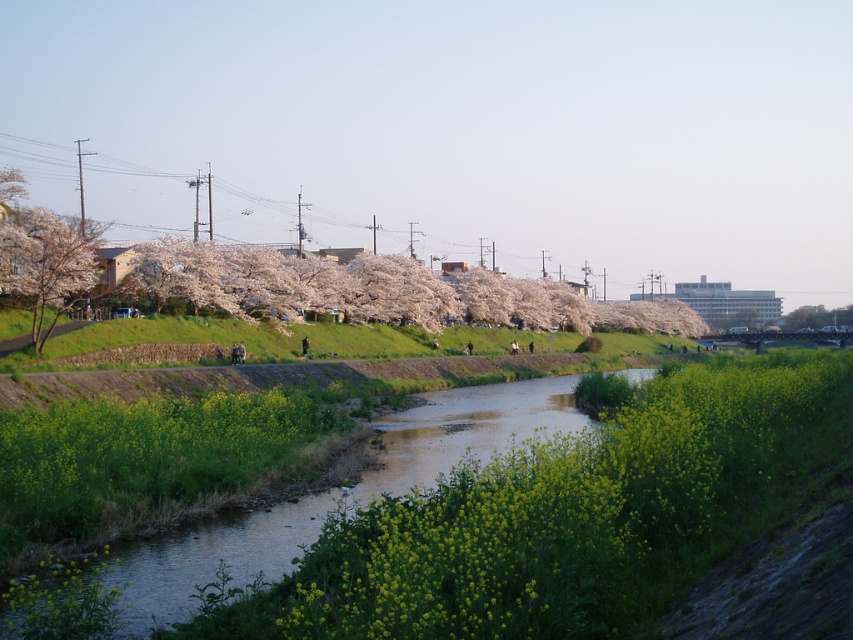
You are planning to cross the river using a small wooden raft that is 2 meters wide. You see the green grassy water at center and the cherry blossom tree at left. Which area should you choose to cross the river safely?

The green grassy water at center is wider than the cherry blossom tree at left, so you should choose the green grassy water at center to cross the river safely since it provides a wider path for the raft.

You are a painter setting up your easel to capture the riverside scene. You want to ensure that the metallic wires at upper center and the cherry blossom tree at left are both visible in your painting. Given their widths, which object should you place closer to the center of your canvas to maintain their relative sizes?

The metallic wires at upper center are wider than the cherry blossom tree at left. To maintain their relative sizes, you should place the metallic wires at upper center closer to the center of the canvas since wider objects are typically positioned centrally for balance.

You are standing at the center of the riverside scene and notice metallic wires at upper center. Based on their position, can you determine if they are closer to the river or the cherry blossom trees on the left embankment?

The metallic wires at upper center are located at coordinates approximately 0.353 on the horizontal axis and 0.427 on the vertical axis. Since the river is in the central lower area and the cherry blossoms are on the left embankment, the wires are closer to the river than the cherry blossoms.